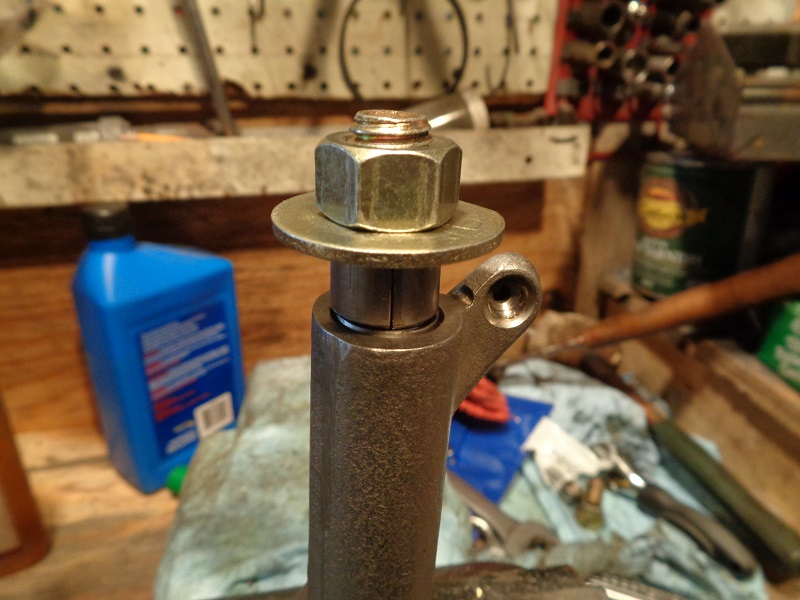
You are a GUI agent. You are given a task and a screenshot of the screen. Output one action in this format:
    pyautogui.click(x=<x>, y=<y>)
    Task: Click on the column
    
    Given the screenshot: What is the action you would take?
    pyautogui.click(x=404, y=443)